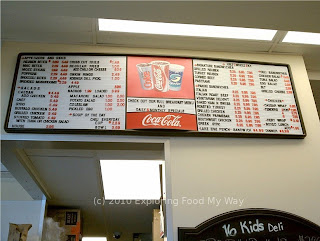
Locate an element on the screen. This screenshot has width=320, height=241. overhead lighting is located at coordinates (143, 184), (191, 30), (299, 37).